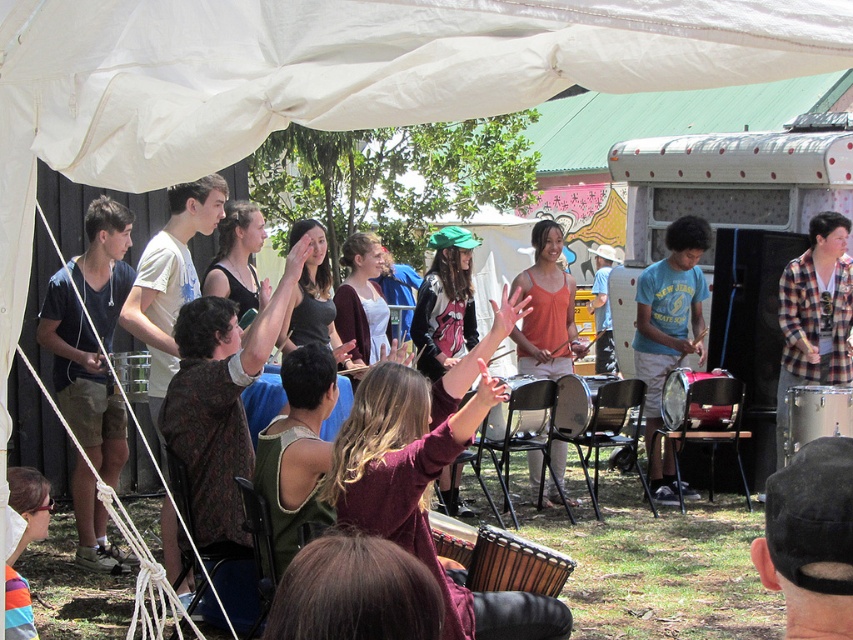
Question: Is dark blue t-shirt at left wider than plaid flannel shirt at right?

Choices:
 (A) yes
 (B) no

Answer: (B)

Question: From the image, what is the correct spatial relationship of dark blue t-shirt at left in relation to black fabric cap at lower right?

Choices:
 (A) right
 (B) left

Answer: (B)

Question: Which object is positioned farthest from the matte orange tank top at center?

Choices:
 (A) plaid flannel shirt at right
 (B) blue cotton t-shirt at center
 (C) dark blue t-shirt at left
 (D) dark brown textured shirt at center

Answer: (C)

Question: Which point is farther from the camera taking this photo?

Choices:
 (A) (691, 310)
 (B) (30, 508)
 (C) (825, 241)

Answer: (A)

Question: Among these objects, which one is farthest from the camera?

Choices:
 (A) dark blue t-shirt at left
 (B) black fabric cap at lower right

Answer: (A)

Question: Is dark blue t-shirt at left further to camera compared to matte black drum at center?

Choices:
 (A) yes
 (B) no

Answer: (B)